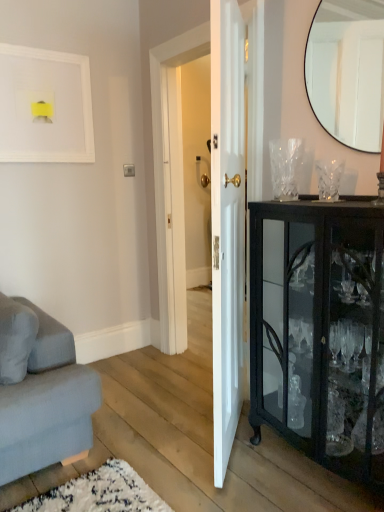
Image resolution: width=384 pixels, height=512 pixels. I want to click on free region on the left part of white glossy door at center, so click(x=144, y=447).